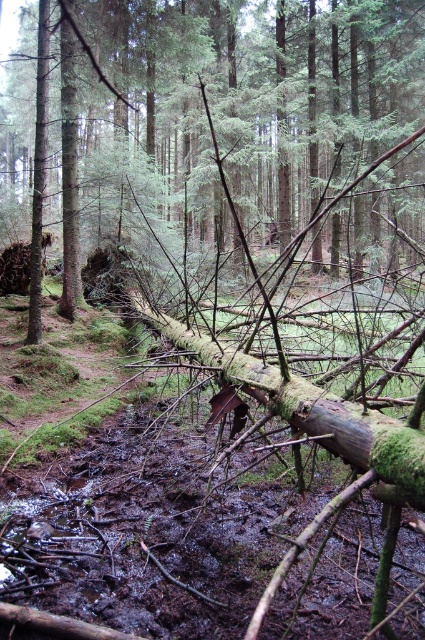
Question: Does green mossy log at center have a greater width compared to muddy wet log at center?

Choices:
 (A) no
 (B) yes

Answer: (B)

Question: Which of the following is the closest to the observer?

Choices:
 (A) click(277, 490)
 (B) click(67, 188)

Answer: (A)

Question: Among these points, which one is farthest from the camera?

Choices:
 (A) (353, 580)
 (B) (269, 264)

Answer: (B)

Question: Can you confirm if green mossy log at center is positioned above muddy wet log at center?

Choices:
 (A) yes
 (B) no

Answer: (A)

Question: Can you confirm if green mossy log at center is positioned to the left of muddy wet log at center?

Choices:
 (A) no
 (B) yes

Answer: (A)

Question: Which point is farther to the camera?

Choices:
 (A) muddy wet log at center
 (B) green mossy log at center

Answer: (A)